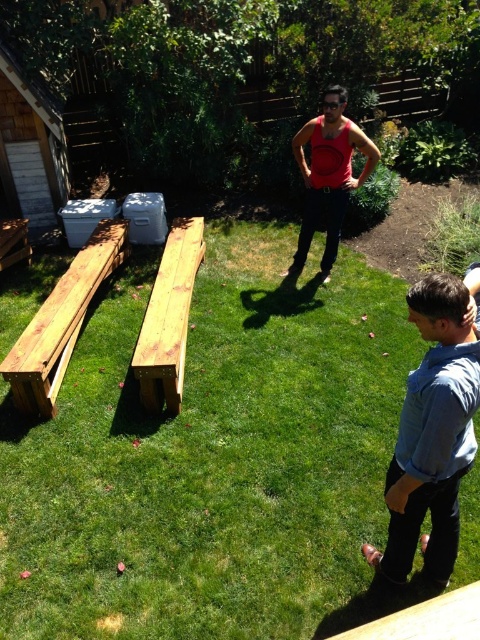
You are standing at the center of the backyard and want to sit on the natural wood bench at center. According to the image, what are the coordinates of the bench where you should walk towards?

The natural wood bench at center is located at coordinates (168,317) so you should walk towards that point.

You are planning to place a large potted plant between the two natural wood benches. Based on their positions, which bench should the plant be closer to? The natural wood bench at left or the natural wood bench at lower left?

The natural wood bench at left is to the right of the natural wood bench at lower left. Therefore, placing the large potted plant closer to the natural wood bench at lower left would position it between them.